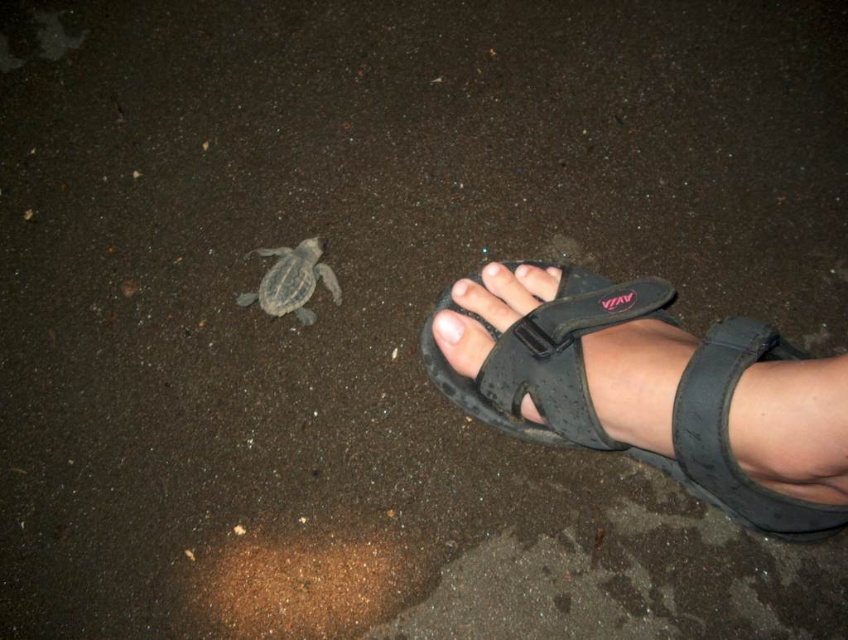
Question: Is pale skin toe at center further to the viewer compared to matte black toe at center?

Choices:
 (A) yes
 (B) no

Answer: (B)

Question: Is smooth skin toe at center to the right of matte black toe at center from the viewer's perspective?

Choices:
 (A) no
 (B) yes

Answer: (A)

Question: Considering the real-world distances, which object is farthest from the smooth skin toe at center?

Choices:
 (A) pale skin toe at center
 (B) black synthetic sandal at lower right
 (C) smooth gray turtle at lower left

Answer: (B)

Question: Considering the real-world distances, which object is closest to the matte black toe at center?

Choices:
 (A) smooth gray turtle at lower left
 (B) black synthetic sandal at lower right
 (C) smooth skin toe at center

Answer: (C)

Question: Can you confirm if smooth gray turtle at lower left is wider than pale skin toe at center?

Choices:
 (A) no
 (B) yes

Answer: (B)

Question: Among these objects, which one is farthest from the camera?

Choices:
 (A) pale skin toe at center
 (B) black synthetic sandal at lower right
 (C) smooth gray turtle at lower left

Answer: (C)